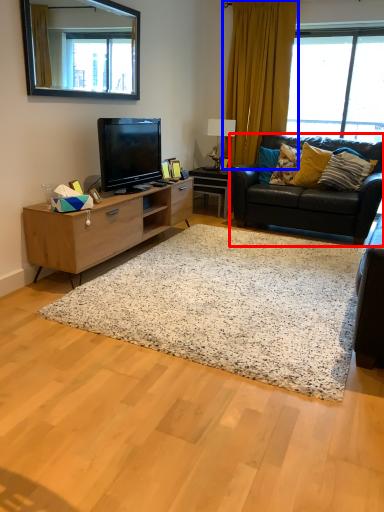
Question: Which of the following is the farthest to the observer, studio couch (highlighted by a red box) or curtain (highlighted by a blue box)?

Choices:
 (A) studio couch
 (B) curtain

Answer: (B)